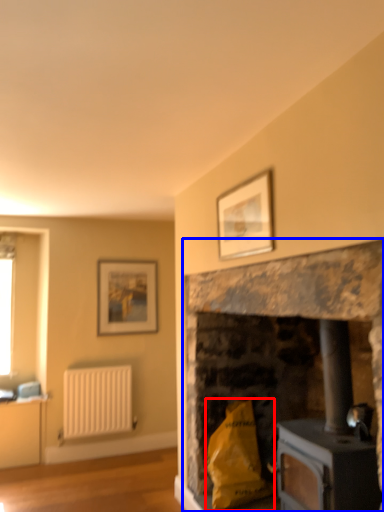
Question: Among these objects, which one is nearest to the camera, material (highlighted by a red box) or fireplace (highlighted by a blue box)?

Choices:
 (A) material
 (B) fireplace

Answer: (B)